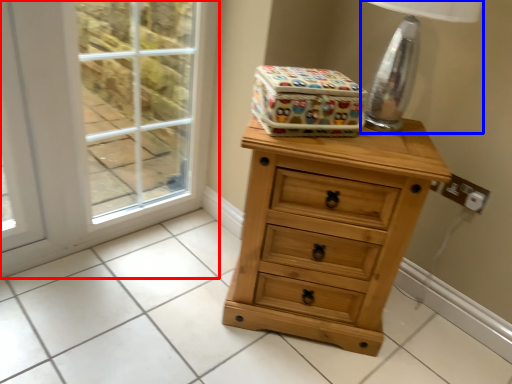
Question: Which of the following is the farthest to the observer, screen door (highlighted by a red box) or table lamp (highlighted by a blue box)?

Choices:
 (A) screen door
 (B) table lamp

Answer: (A)